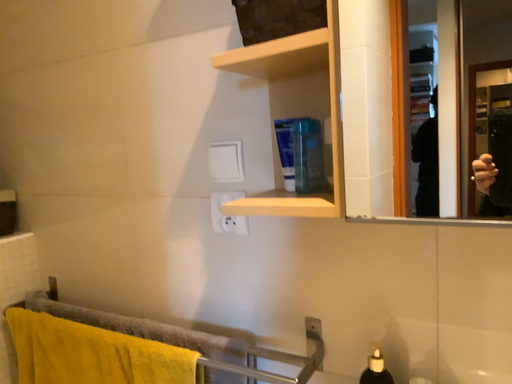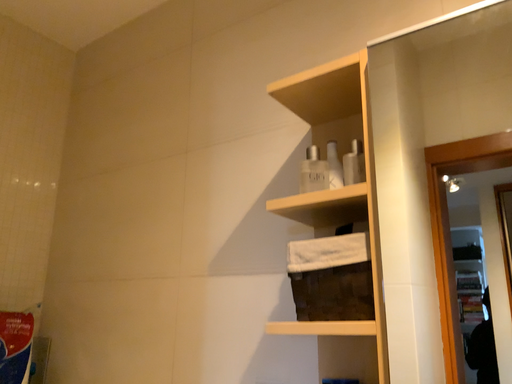
Question: How did the camera likely rotate when shooting the video?

Choices:
 (A) rotated downward
 (B) rotated upward

Answer: (B)